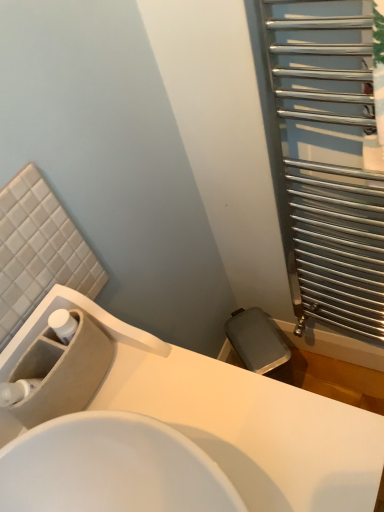
Describe the element at coordinates (325, 159) in the screenshot. This screenshot has height=512, width=384. I see `silver metallic radiator at right` at that location.

You are a GUI agent. You are given a task and a screenshot of the screen. Output one action in this format:
    pyautogui.click(x=<x>, y=<y>)
    Task: Click on the beige matte sink at lower left, placed as the first sink when sorted from back to front
    Image resolution: width=384 pixels, height=512 pixels.
    Given the screenshot: What is the action you would take?
    pyautogui.click(x=58, y=376)

This screenshot has width=384, height=512. Describe the element at coordinates (235, 417) in the screenshot. I see `white glossy sink at center, the 1th sink in the front-to-back sequence` at that location.

Where is `silver metallic radiator at right`? silver metallic radiator at right is located at coordinates (325, 159).

Who is taller, silver metallic radiator at right or white glossy sink at center, the 1th sink in the front-to-back sequence?

Standing taller between the two is silver metallic radiator at right.

From the image's perspective, would you say silver metallic radiator at right is positioned over white glossy sink at center, which is the second sink from back to front?

Correct, silver metallic radiator at right appears higher than white glossy sink at center, which is the second sink from back to front, in the image.

Between silver metallic radiator at right and white glossy sink at center, which is the second sink from back to front, which one has larger size?

white glossy sink at center, which is the second sink from back to front.

Considering their positions, is silver metallic radiator at right located in front of or behind white glossy sink at center, the 1th sink in the front-to-back sequence?

In the image, silver metallic radiator at right appears behind white glossy sink at center, the 1th sink in the front-to-back sequence.

Could you tell me if white glossy sink at center, which is the second sink from back to front, is facing silver metallic radiator at right?

No, white glossy sink at center, which is the second sink from back to front, does not turn towards silver metallic radiator at right.

What's the angular difference between white glossy sink at center, which is the second sink from back to front, and silver metallic radiator at right's facing directions?

The angle between the facing direction of white glossy sink at center, which is the second sink from back to front, and the facing direction of silver metallic radiator at right is 89.8 degrees.

Considering the relative positions of white glossy sink at center, which is the second sink from back to front, and silver metallic radiator at right in the image provided, is white glossy sink at center, which is the second sink from back to front, to the left or to the right of silver metallic radiator at right?

white glossy sink at center, which is the second sink from back to front, is positioned on silver metallic radiator at right's left side.

Considering the relative sizes of white glossy sink at center, the 1th sink in the front-to-back sequence, and silver metallic radiator at right in the image provided, is white glossy sink at center, the 1th sink in the front-to-back sequence, smaller than silver metallic radiator at right?

No.

Is beige matte sink at lower left, placed as the first sink when sorted from back to front, inside the boundaries of silver metallic radiator at right, or outside?

beige matte sink at lower left, placed as the first sink when sorted from back to front, is spatially situated outside silver metallic radiator at right.

Considering the positions of objects beige matte sink at lower left, placed as the first sink when sorted from back to front, and silver metallic radiator at right in the image provided, who is more to the right, beige matte sink at lower left, placed as the first sink when sorted from back to front, or silver metallic radiator at right?

silver metallic radiator at right.

Is beige matte sink at lower left, placed as the first sink when sorted from back to front, in contact with silver metallic radiator at right?

No.

Is beige matte sink at lower left, which is the 2th sink in front-to-back order, facing towards silver metallic radiator at right?

No, beige matte sink at lower left, which is the 2th sink in front-to-back order, is not aimed at silver metallic radiator at right.

Would you say white glossy sink at center, the 1th sink in the front-to-back sequence, is a long distance from beige matte sink at lower left, placed as the first sink when sorted from back to front?

Actually, white glossy sink at center, the 1th sink in the front-to-back sequence, and beige matte sink at lower left, placed as the first sink when sorted from back to front, are a little close together.

The height and width of the screenshot is (512, 384). In the image, there is a beige matte sink at lower left, placed as the first sink when sorted from back to front. In order to click on sink below it (from the image's perspective) in this screenshot , I will do `click(235, 417)`.

Does white glossy sink at center, the 1th sink in the front-to-back sequence, have a lesser width compared to beige matte sink at lower left, which is the 2th sink in front-to-back order?

Incorrect, the width of white glossy sink at center, the 1th sink in the front-to-back sequence, is not less than that of beige matte sink at lower left, which is the 2th sink in front-to-back order.

From the image's perspective, is white glossy sink at center, the 1th sink in the front-to-back sequence, located above beige matte sink at lower left, which is the 2th sink in front-to-back order?

No.

You are a GUI agent. You are given a task and a screenshot of the screen. Output one action in this format:
    pyautogui.click(x=<x>, y=<y>)
    Task: Click on the screen door that is under the beige matte sink at lower left, placed as the first sink when sorted from back to front (from a real-world perspective)
    The width and height of the screenshot is (384, 512).
    Given the screenshot: What is the action you would take?
    pyautogui.click(x=325, y=159)

Between silver metallic radiator at right and beige matte sink at lower left, which is the 2th sink in front-to-back order, which one has less height?

beige matte sink at lower left, which is the 2th sink in front-to-back order, is shorter.

Is the surface of silver metallic radiator at right in direct contact with beige matte sink at lower left, placed as the first sink when sorted from back to front?

silver metallic radiator at right and beige matte sink at lower left, placed as the first sink when sorted from back to front, are clearly separated.

Considering the positions of points (332, 215) and (59, 344), is point (332, 215) farther from camera compared to point (59, 344)?

Yes, point (332, 215) is behind point (59, 344).

Is beige matte sink at lower left, which is the 2th sink in front-to-back order, behind white glossy sink at center, the 1th sink in the front-to-back sequence?

Yes, beige matte sink at lower left, which is the 2th sink in front-to-back order, is behind white glossy sink at center, the 1th sink in the front-to-back sequence.

Is beige matte sink at lower left, which is the 2th sink in front-to-back order, inside or outside of white glossy sink at center, the 1th sink in the front-to-back sequence?

beige matte sink at lower left, which is the 2th sink in front-to-back order, exists entirely within white glossy sink at center, the 1th sink in the front-to-back sequence.

Looking at their sizes, would you say beige matte sink at lower left, placed as the first sink when sorted from back to front, is wider or thinner than white glossy sink at center, the 1th sink in the front-to-back sequence?

Clearly, beige matte sink at lower left, placed as the first sink when sorted from back to front, has less width compared to white glossy sink at center, the 1th sink in the front-to-back sequence.

Considering the points (43, 340) and (346, 354), which point is behind, point (43, 340) or point (346, 354)?

The point (346, 354) is behind.

This screenshot has height=512, width=384. In order to click on screen door above the white glossy sink at center, the 1th sink in the front-to-back sequence (from a real-world perspective) in this screenshot , I will do `click(325, 159)`.

Identify the location of the 1st sink to the left of the silver metallic radiator at right, starting your count from the anchor. pyautogui.click(x=235, y=417).

Which object lies further to the anchor point white glossy sink at center, the 1th sink in the front-to-back sequence, silver metallic radiator at right or beige matte sink at lower left, placed as the first sink when sorted from back to front?

silver metallic radiator at right is positioned further to the anchor white glossy sink at center, the 1th sink in the front-to-back sequence.

Based on their spatial positions, is beige matte sink at lower left, placed as the first sink when sorted from back to front, or white glossy sink at center, the 1th sink in the front-to-back sequence, closer to silver metallic radiator at right?

Based on the image, white glossy sink at center, the 1th sink in the front-to-back sequence, appears to be nearer to silver metallic radiator at right.

Considering their positions, is silver metallic radiator at right positioned closer to beige matte sink at lower left, which is the 2th sink in front-to-back order, than white glossy sink at center, the 1th sink in the front-to-back sequence?

Among the two, white glossy sink at center, the 1th sink in the front-to-back sequence, is located nearer to beige matte sink at lower left, which is the 2th sink in front-to-back order.

Which object lies further to the anchor point beige matte sink at lower left, placed as the first sink when sorted from back to front, white glossy sink at center, which is the second sink from back to front, or silver metallic radiator at right?

The object further to beige matte sink at lower left, placed as the first sink when sorted from back to front, is silver metallic radiator at right.

When comparing their distances from silver metallic radiator at right, does white glossy sink at center, the 1th sink in the front-to-back sequence, or beige matte sink at lower left, which is the 2th sink in front-to-back order, seem further?

The object further to silver metallic radiator at right is beige matte sink at lower left, which is the 2th sink in front-to-back order.

Looking at this image, considering their positions, is beige matte sink at lower left, which is the 2th sink in front-to-back order, positioned further to white glossy sink at center, the 1th sink in the front-to-back sequence, than silver metallic radiator at right?

Among the two, silver metallic radiator at right is located further to white glossy sink at center, the 1th sink in the front-to-back sequence.

Image resolution: width=384 pixels, height=512 pixels. What are the coordinates of `sink that lies between silver metallic radiator at right and white glossy sink at center, which is the second sink from back to front, from top to bottom` in the screenshot? It's located at (58, 376).